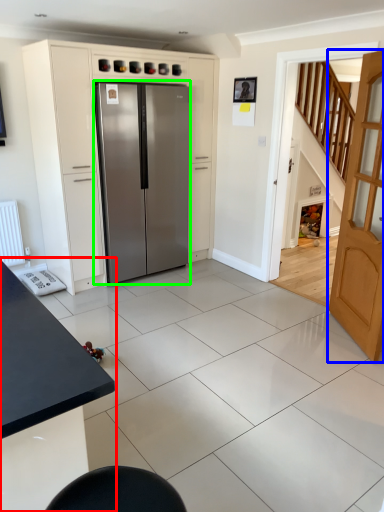
Question: Considering the real-world distances, which object is farthest from table (highlighted by a red box)? door (highlighted by a blue box) or refrigerator (highlighted by a green box)?

Choices:
 (A) door
 (B) refrigerator

Answer: (B)